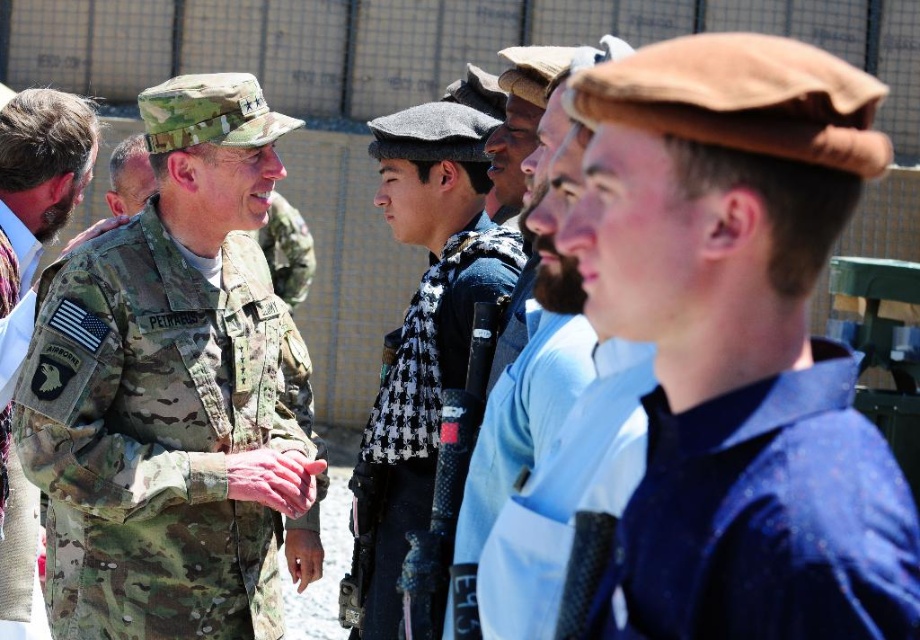
Who is more distant from viewer, (x=109, y=602) or (x=788, y=560)?

The point (x=109, y=602) is more distant.

Locate an element on the screen. The image size is (920, 640). camouflage uniform at center is located at coordinates (170, 392).

Who is lower down, brown felt cap at center or black and white checkered scarf at center?

black and white checkered scarf at center

Is brown felt cap at center bigger than black and white checkered scarf at center?

No.

Is point (888, 150) behind point (486, 273)?

No.

This screenshot has height=640, width=920. I want to click on brown felt cap at center, so click(739, 346).

Is camouflage uniform at center taller than camouflage uniform at left?

Indeed, camouflage uniform at center has a greater height compared to camouflage uniform at left.

Describe the element at coordinates (170, 392) in the screenshot. Image resolution: width=920 pixels, height=640 pixels. I see `camouflage uniform at center` at that location.

Locate an element on the screen. This screenshot has height=640, width=920. camouflage uniform at center is located at coordinates (170, 392).